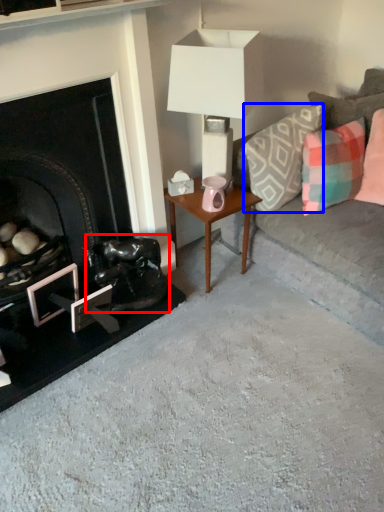
Question: Which of the following is the farthest to the observer, swivel chair (highlighted by a red box) or pillow (highlighted by a blue box)?

Choices:
 (A) swivel chair
 (B) pillow

Answer: (A)